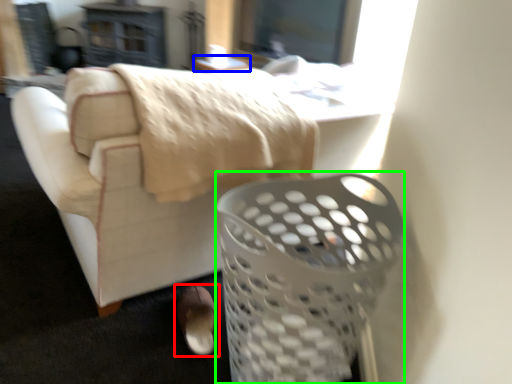
Question: Estimate the real-world distances between objects in this image. Which object is closer to footwear (highlighted by a red box), table (highlighted by a blue box) or basket (highlighted by a green box)?

Choices:
 (A) table
 (B) basket

Answer: (B)